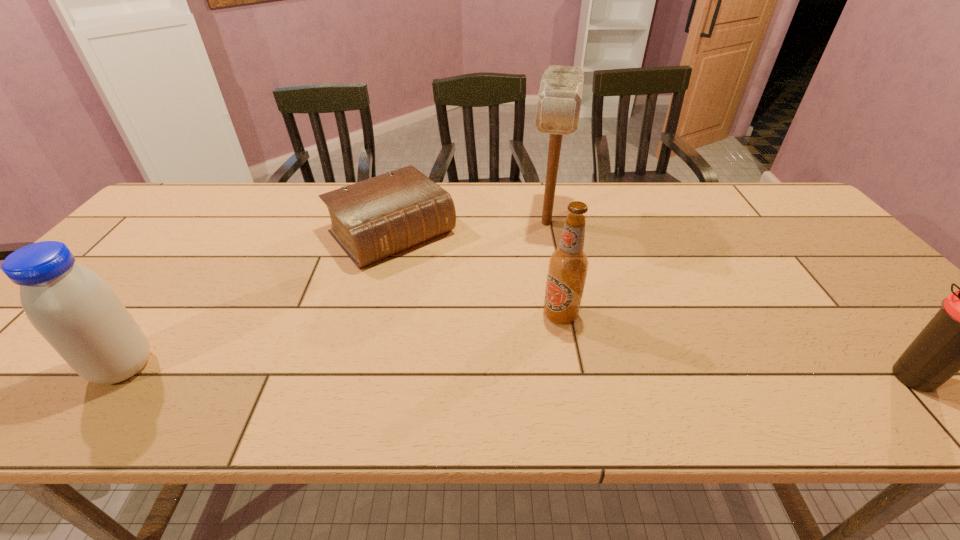
You are a GUI agent. You are given a task and a screenshot of the screen. Output one action in this format:
    pyautogui.click(x=<x>, y=<y>)
    Task: Click on the vacant space located on the spine side of the Bible
    
    Given the screenshot: What is the action you would take?
    pyautogui.click(x=512, y=353)

Where is `vacant space located 0.250m on the spine side of the Bible`? vacant space located 0.250m on the spine side of the Bible is located at coordinates (479, 320).

Locate an element on the screen. Image resolution: width=960 pixels, height=540 pixels. vacant area situated on the front label of the third farthest object is located at coordinates (433, 371).

Image resolution: width=960 pixels, height=540 pixels. In order to click on free space located on the front label of the third farthest object in this screenshot , I will do `click(445, 365)`.

Where is `vacant space located 0.160m on the front label of the third farthest object`? vacant space located 0.160m on the front label of the third farthest object is located at coordinates (487, 347).

At what (x,y) coordinates should I click in order to perform the action: click on free space located 0.320m above the head of the tallest object. Please return your answer as a coordinate pair (x, y). Looking at the image, I should click on (534, 326).

At what (x,y) coordinates should I click in order to perform the action: click on free space located 0.350m above the head of the tallest object. Please return your answer as a coordinate pair (x, y). Looking at the image, I should click on (533, 336).

Identify the location of vacant area located 0.390m above the head of the tallest object. The width and height of the screenshot is (960, 540). (531, 349).

Where is `Bible that is at the far edge`? The image size is (960, 540). Bible that is at the far edge is located at coordinates (371, 220).

Locate an element on the screen. mallet that is at the far edge is located at coordinates (559, 99).